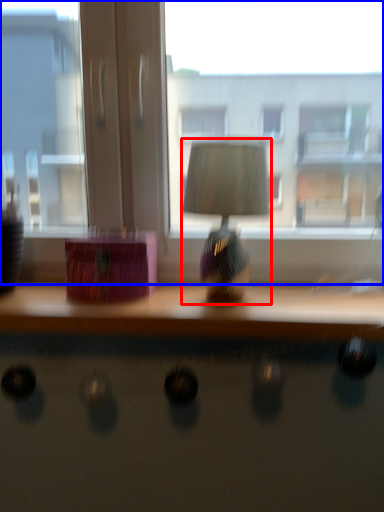
Question: Which of the following is the closest to the observer, table lamp (highlighted by a red box) or window (highlighted by a blue box)?

Choices:
 (A) table lamp
 (B) window

Answer: (A)